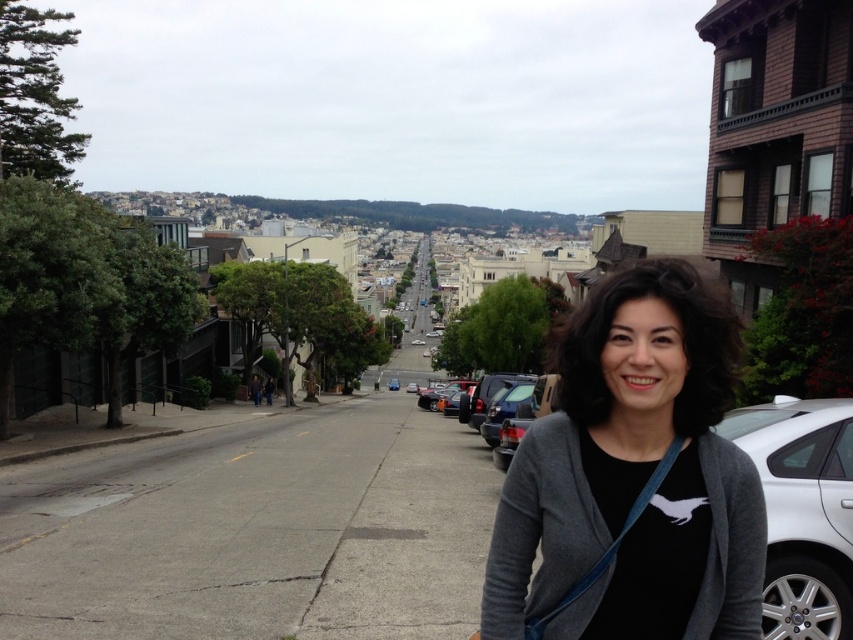
Question: Can you confirm if gray fabric at center is smaller than white matte car at lower right?

Choices:
 (A) yes
 (B) no

Answer: (A)

Question: Is gray fabric at center bigger than white matte car at lower right?

Choices:
 (A) no
 (B) yes

Answer: (A)

Question: Where is gray fabric at center located in relation to white matte car at lower right in the image?

Choices:
 (A) above
 (B) below

Answer: (A)